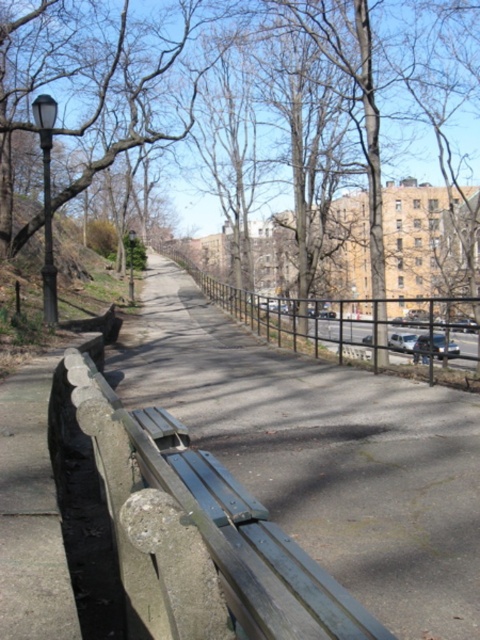
Can you confirm if concrete bench at center is positioned below black metal fence at center?

Yes.

Consider the image. Does concrete bench at center appear on the right side of black metal fence at center?

In fact, concrete bench at center is to the left of black metal fence at center.

Does point (173, 589) come closer to viewer compared to point (380, 346)?

Yes.

Find the location of a particular element. Image resolution: width=480 pixels, height=640 pixels. concrete bench at center is located at coordinates (203, 531).

Can you confirm if concrete bench at center is positioned to the left of brown leafless tree at upper center?

Correct, you'll find concrete bench at center to the left of brown leafless tree at upper center.

From the picture: Between concrete bench at center and brown leafless tree at upper center, which one is positioned higher?

brown leafless tree at upper center

Which is behind, point (200, 534) or point (143, 108)?

Point (143, 108)

Image resolution: width=480 pixels, height=640 pixels. In order to click on concrete bench at center in this screenshot , I will do `click(203, 531)`.

Looking at this image, can you confirm if brown leafless tree at upper center is positioned to the right of black metal fence at center?

Incorrect, brown leafless tree at upper center is not on the right side of black metal fence at center.

Does brown leafless tree at upper center appear on the left side of black metal fence at center?

Correct, you'll find brown leafless tree at upper center to the left of black metal fence at center.

This screenshot has height=640, width=480. What do you see at coordinates (87, 54) in the screenshot? I see `brown leafless tree at upper center` at bounding box center [87, 54].

This screenshot has width=480, height=640. In order to click on brown leafless tree at upper center in this screenshot , I will do click(x=87, y=54).